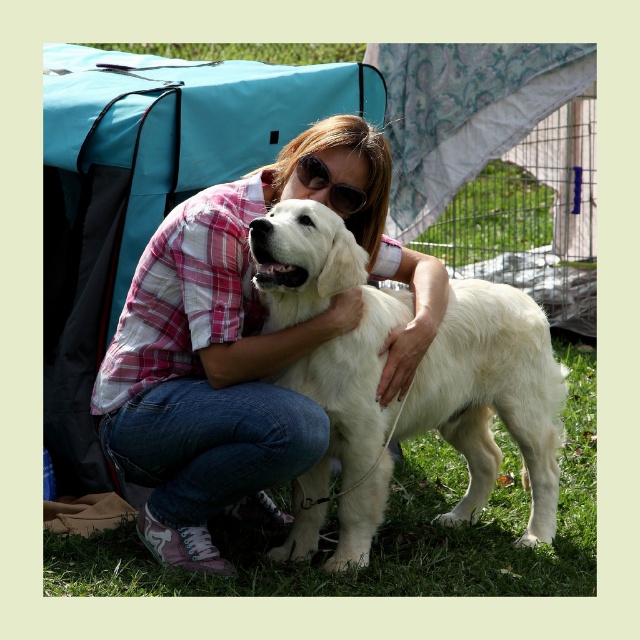
Question: Among these objects, which one is nearest to the camera?

Choices:
 (A) sunglasses at center
 (B) white fluffy dog at center

Answer: (B)

Question: Can you confirm if pink plaid shirt at center is positioned below white fluffy dog at center?

Choices:
 (A) yes
 (B) no

Answer: (B)

Question: Which point is closer to the camera taking this photo?

Choices:
 (A) (125, 381)
 (B) (316, 182)
 (C) (358, 426)

Answer: (B)

Question: From the image, what is the correct spatial relationship of white fluffy dog at center in relation to sunglasses at center?

Choices:
 (A) above
 (B) below

Answer: (B)

Question: Which object is the farthest from the pink plaid shirt at center?

Choices:
 (A) sunglasses at center
 (B) white fluffy dog at center

Answer: (A)

Question: Considering the relative positions of pink plaid shirt at center and white fluffy dog at center in the image provided, where is pink plaid shirt at center located with respect to white fluffy dog at center?

Choices:
 (A) below
 (B) above

Answer: (B)